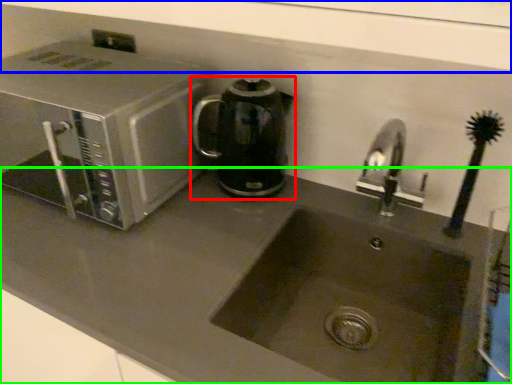
Question: Which is farther away from kitchen appliance (highlighted by a red box)? window sill (highlighted by a blue box) or counter top (highlighted by a green box)?

Choices:
 (A) window sill
 (B) counter top

Answer: (A)